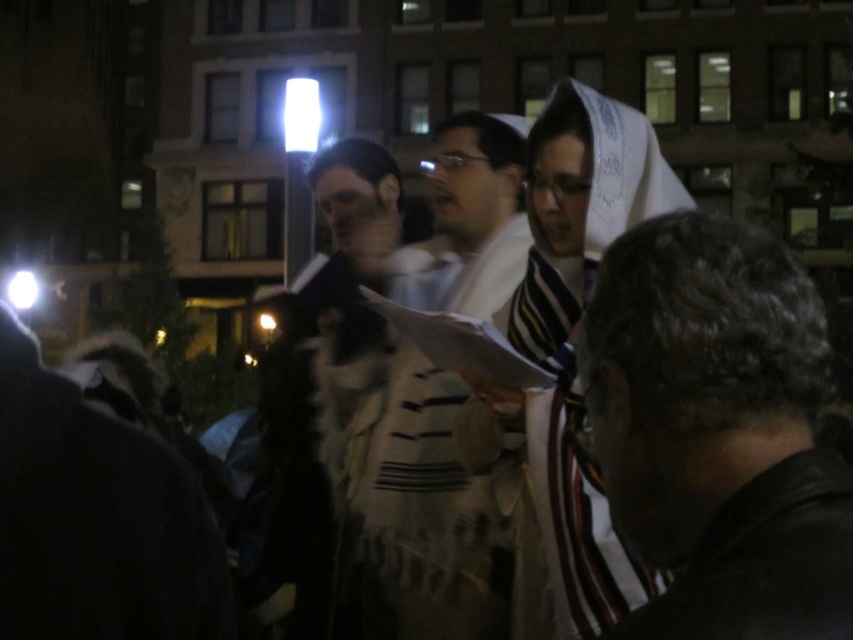
Who is positioned more to the left, dark brown leather jacket at lower right or white textured shawl at center?

From the viewer's perspective, white textured shawl at center appears more on the left side.

Is point (802, 522) positioned after point (340, 161)?

No.

Image resolution: width=853 pixels, height=640 pixels. Identify the location of dark brown leather jacket at lower right. (718, 433).

Locate an element on the screen. dark brown leather jacket at lower right is located at coordinates (718, 433).

Can you confirm if white fur coat at center is thinner than striped fabric robe at lower right?

Incorrect, white fur coat at center's width is not less than striped fabric robe at lower right's.

Between white fur coat at center and striped fabric robe at lower right, which one is positioned lower?

striped fabric robe at lower right

Find the location of a particular element. This screenshot has width=853, height=640. white fur coat at center is located at coordinates (331, 362).

Is dark brown leather jacket at lower right thinner than striped fabric robe at lower right?

Incorrect, dark brown leather jacket at lower right's width is not less than striped fabric robe at lower right's.

Is dark brown leather jacket at lower right below striped fabric robe at lower right?

No.

Who is more forward, (686, 212) or (726, 525)?

Point (726, 525) is more forward.

At what (x,y) coordinates should I click in order to perform the action: click on dark brown leather jacket at lower right. Please return your answer as a coordinate pair (x, y). This screenshot has height=640, width=853. Looking at the image, I should click on (718, 433).